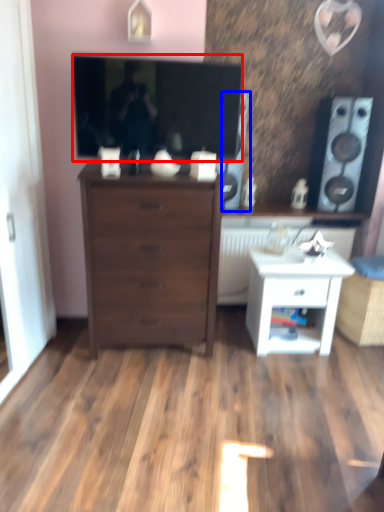
Question: Which object is closer to the camera taking this photo, television (highlighted by a red box) or speaker (highlighted by a blue box)?

Choices:
 (A) television
 (B) speaker

Answer: (A)